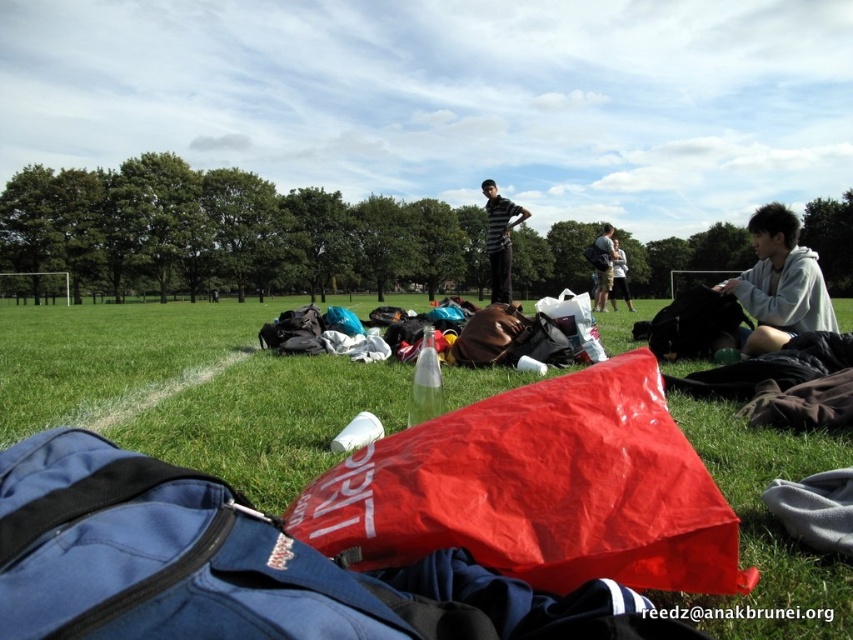
Is green grass at center wider than striped fabric shirt at center?

Indeed, green grass at center has a greater width compared to striped fabric shirt at center.

Which is behind, point (323, 445) or point (503, 248)?

Point (503, 248)

Locate an element on the screen. green grass at center is located at coordinates (189, 388).

Where is `green grass at center`? The width and height of the screenshot is (853, 640). green grass at center is located at coordinates (189, 388).

The width and height of the screenshot is (853, 640). Describe the element at coordinates (779, 284) in the screenshot. I see `sweatshirt at lower right` at that location.

Identify the location of sweatshirt at lower right. (779, 284).

Between point (497, 218) and point (619, 266), which one is positioned behind?

Point (619, 266)

Does striped fabric shirt at center appear on the left side of light brown striped shirt at center?

Indeed, striped fabric shirt at center is positioned on the left side of light brown striped shirt at center.

Who is more forward, (503, 262) or (619, 248)?

Point (503, 262) is in front.

You are a GUI agent. You are given a task and a screenshot of the screen. Output one action in this format:
    pyautogui.click(x=<x>, y=<y>)
    Task: Click on the striped fabric shirt at center
    
    Given the screenshot: What is the action you would take?
    pyautogui.click(x=500, y=240)